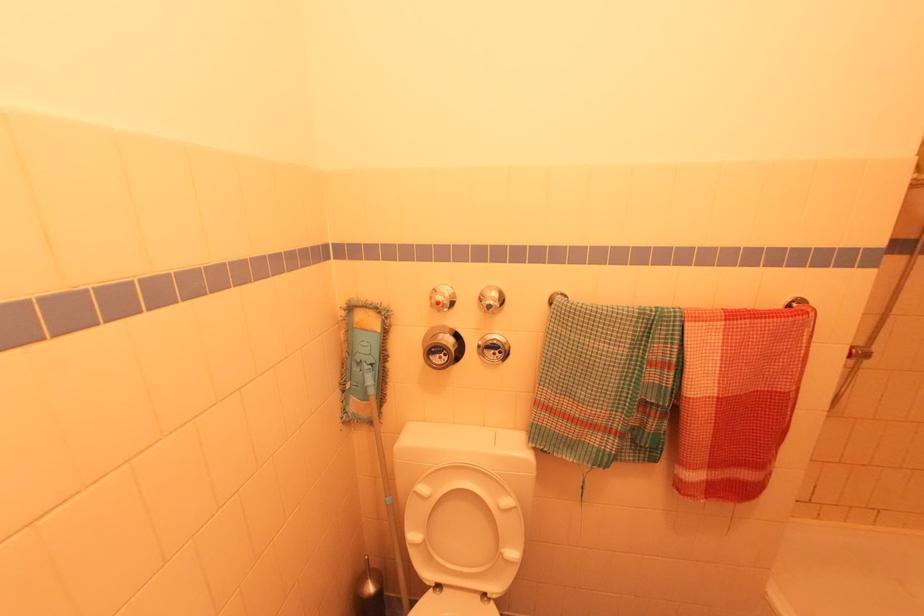
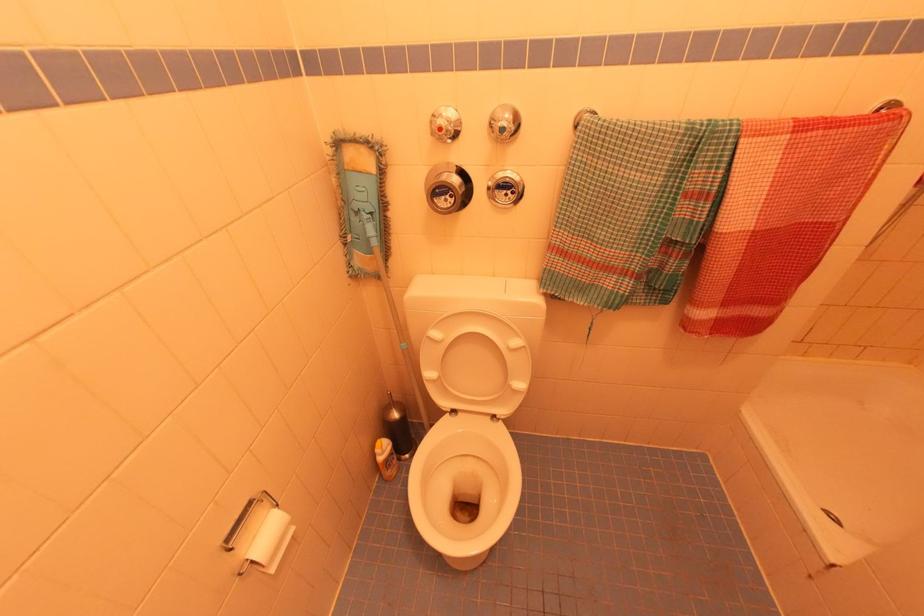
Find the pixel in the second image that matches point 492,288 in the first image.

(505, 108)